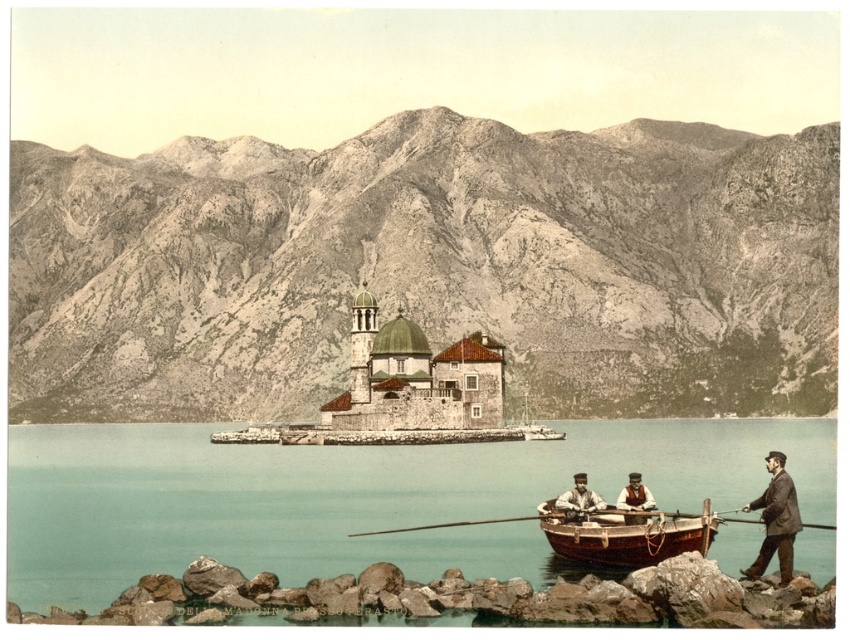
You are standing at a viewpoint overlooking the island and its historic building. You notice two points marked on the scene. Which of the two points, point (34, 205) or point (622, 490), is closer to your current position?

Point (34, 205) is closer to your current position because it is further to the camera than point (622, 490).

You are standing on the rocky shoreline and see the teal water at lower center and the brown leather jacket at lower right. Which object is taller from your perspective?

The brown leather jacket at lower right is taller than the teal water at lower center.